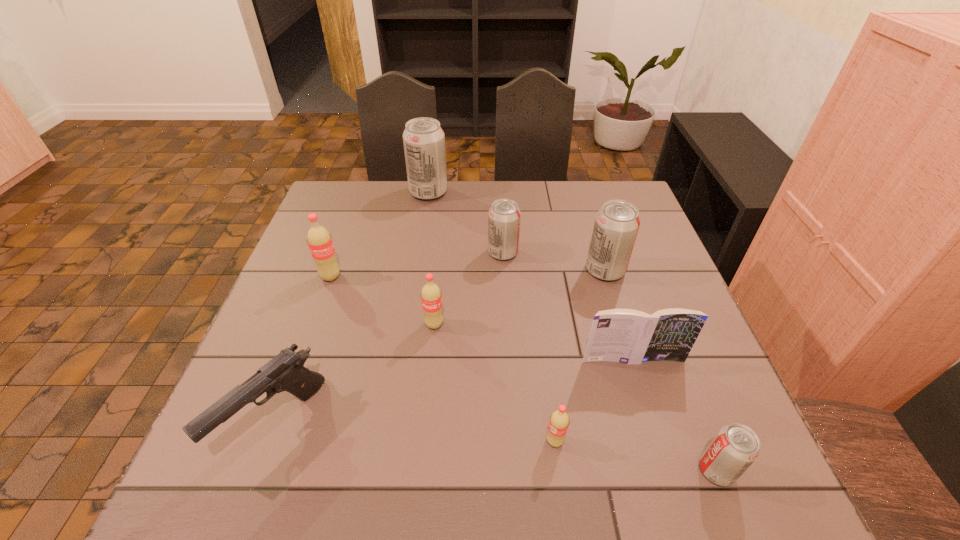
Locate an element on the screen. Image resolution: width=960 pixels, height=540 pixels. the farthest gray soda can is located at coordinates (423, 138).

Identify the location of the leftmost gray soda can. The image size is (960, 540). (423, 138).

Identify the location of the leftmost red soda. (319, 240).

This screenshot has height=540, width=960. Find the location of `the leftmost soda can`. the leftmost soda can is located at coordinates (319, 240).

Find the location of a particular element. the second biggest gray soda can is located at coordinates (616, 225).

Identify the location of the second gray soda can from right to left. (616, 225).

Where is `the third gray soda can from right to left`? The image size is (960, 540). the third gray soda can from right to left is located at coordinates (504, 216).

Locate an element on the screen. The height and width of the screenshot is (540, 960). the fourth soda can from right to left is located at coordinates (504, 216).

This screenshot has height=540, width=960. Identify the location of the second biggest red soda. (431, 297).

The width and height of the screenshot is (960, 540). In order to click on the second red soda from right to left in this screenshot , I will do `click(431, 297)`.